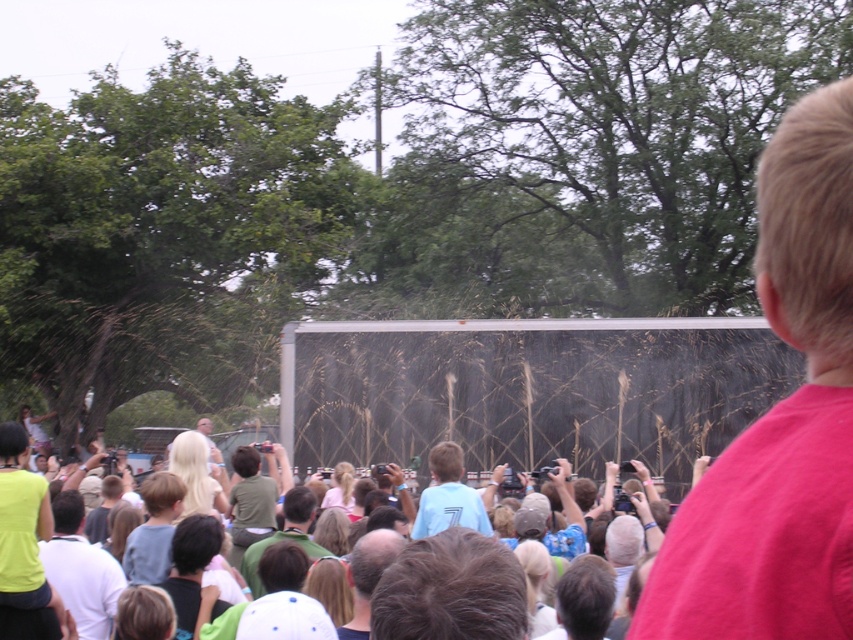
Can you confirm if dark brown hair at center is taller than white matte shirt at lower left?

In fact, dark brown hair at center may be shorter than white matte shirt at lower left.

Which is more to the right, dark brown hair at center or white matte shirt at lower left?

From the viewer's perspective, dark brown hair at center appears more on the right side.

Identify the location of dark brown hair at center. (450, 589).

You are a GUI agent. You are given a task and a screenshot of the screen. Output one action in this format:
    pyautogui.click(x=<x>, y=<y>)
    Task: Click on the dark brown hair at center
    The width and height of the screenshot is (853, 640).
    Given the screenshot: What is the action you would take?
    pyautogui.click(x=450, y=589)

Can you confirm if white matte shirt at lower left is shorter than green fabric shirt at center?

No, white matte shirt at lower left is not shorter than green fabric shirt at center.

Between point (120, 570) and point (254, 532), which one is positioned in front?

Point (120, 570) is in front.

Does point (114, 611) lie in front of point (254, 522)?

Yes.

Identify the location of white matte shirt at lower left. The image size is (853, 640). (80, 570).

Does point (833, 136) lie behind point (45, 576)?

No, (833, 136) is in front of (45, 576).

Between pink cotton shirt at right and white matte shirt at lower left, which one has more height?

Standing taller between the two is pink cotton shirt at right.

Describe the element at coordinates (780, 420) in the screenshot. I see `pink cotton shirt at right` at that location.

The width and height of the screenshot is (853, 640). Find the location of `pink cotton shirt at right`. pink cotton shirt at right is located at coordinates (780, 420).